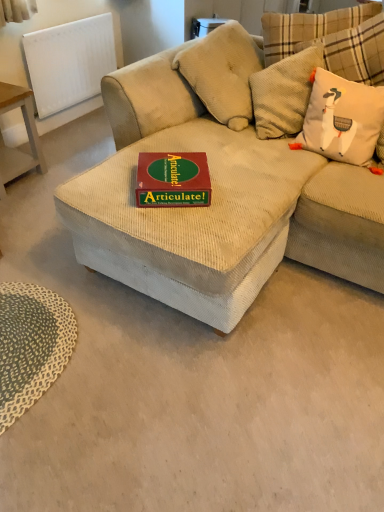
Question: Is green textured mat at lower left bigger than white textured radiator at upper left?

Choices:
 (A) no
 (B) yes

Answer: (A)

Question: Is green textured mat at lower left taller than white textured radiator at upper left?

Choices:
 (A) yes
 (B) no

Answer: (B)

Question: From a real-world perspective, is green textured mat at lower left located higher than white textured radiator at upper left?

Choices:
 (A) yes
 (B) no

Answer: (B)

Question: Is the surface of green textured mat at lower left in direct contact with white textured radiator at upper left?

Choices:
 (A) yes
 (B) no

Answer: (B)

Question: Can you confirm if green textured mat at lower left is wider than white textured radiator at upper left?

Choices:
 (A) no
 (B) yes

Answer: (B)

Question: From a real-world perspective, is green textured mat at lower left above or below white textured radiator at upper left?

Choices:
 (A) above
 (B) below

Answer: (B)

Question: In terms of height, does green textured mat at lower left look taller or shorter compared to white textured radiator at upper left?

Choices:
 (A) tall
 (B) short

Answer: (B)

Question: Choose the correct answer: Is green textured mat at lower left inside white textured radiator at upper left or outside it?

Choices:
 (A) inside
 (B) outside

Answer: (B)

Question: Does point (6, 374) appear closer or farther from the camera than point (89, 54)?

Choices:
 (A) farther
 (B) closer

Answer: (B)

Question: Considering the positions of point (24, 153) and point (29, 311), is point (24, 153) closer or farther from the camera than point (29, 311)?

Choices:
 (A) farther
 (B) closer

Answer: (A)

Question: From the image's perspective, is wooden table at left located above or below green textured mat at lower left?

Choices:
 (A) below
 (B) above

Answer: (B)

Question: Is wooden table at left spatially inside green textured mat at lower left, or outside of it?

Choices:
 (A) outside
 (B) inside

Answer: (A)

Question: In the image, is wooden table at left positioned in front of or behind green textured mat at lower left?

Choices:
 (A) front
 (B) behind

Answer: (B)

Question: Considering the relative positions of green textured mat at lower left and green matte board game at center in the image provided, is green textured mat at lower left to the left or to the right of green matte board game at center?

Choices:
 (A) left
 (B) right

Answer: (A)

Question: Is green textured mat at lower left in front of or behind green matte board game at center in the image?

Choices:
 (A) behind
 (B) front

Answer: (B)